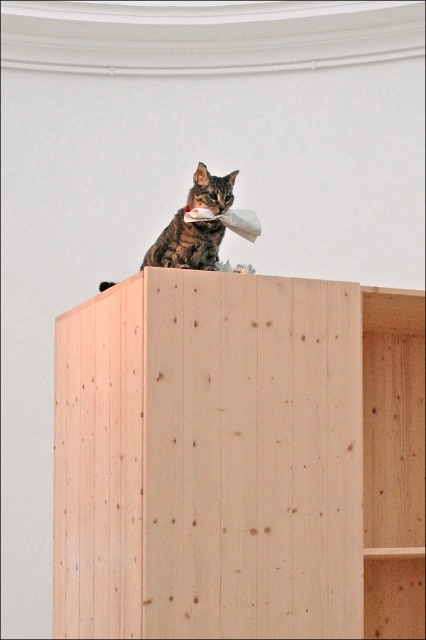
Question: Which object is closer to the camera taking this photo?

Choices:
 (A) tabby fur cat at upper center
 (B) natural wood bookshelf at upper center

Answer: (B)

Question: Considering the relative positions of natural wood bookshelf at upper center and tabby fur cat at upper center in the image provided, where is natural wood bookshelf at upper center located with respect to tabby fur cat at upper center?

Choices:
 (A) left
 (B) right

Answer: (B)

Question: Among these points, which one is farthest from the camera?

Choices:
 (A) (350, 454)
 (B) (210, 225)

Answer: (B)

Question: Can you confirm if natural wood bookshelf at upper center is positioned to the left of tabby fur cat at upper center?

Choices:
 (A) yes
 (B) no

Answer: (B)

Question: Which point appears closest to the camera in this image?

Choices:
 (A) (336, 445)
 (B) (213, 204)

Answer: (A)

Question: Can you confirm if natural wood bookshelf at upper center is positioned to the left of tabby fur cat at upper center?

Choices:
 (A) no
 (B) yes

Answer: (A)